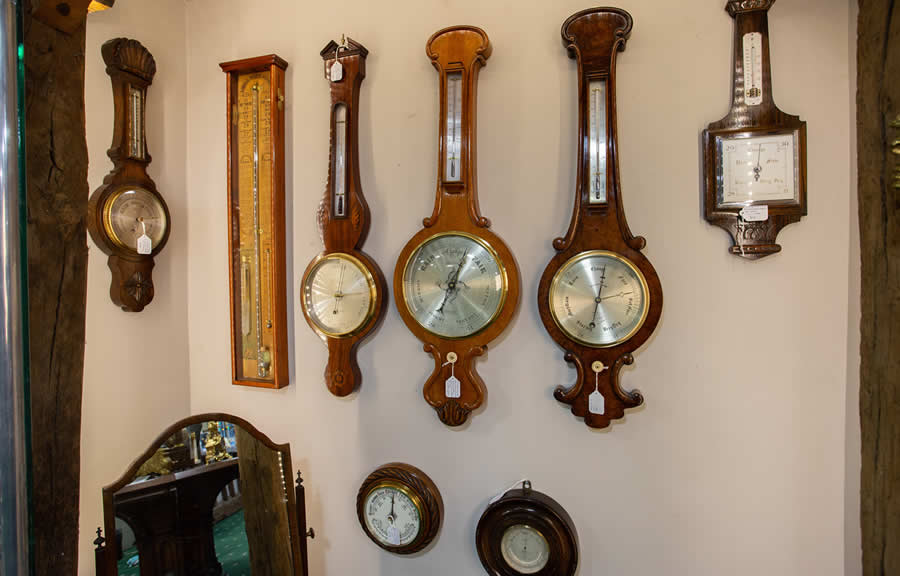
I want to click on clocks on the wall, so click(750, 112), click(608, 161), click(452, 185), click(344, 211), click(250, 209), click(129, 209), click(403, 501), click(541, 551).